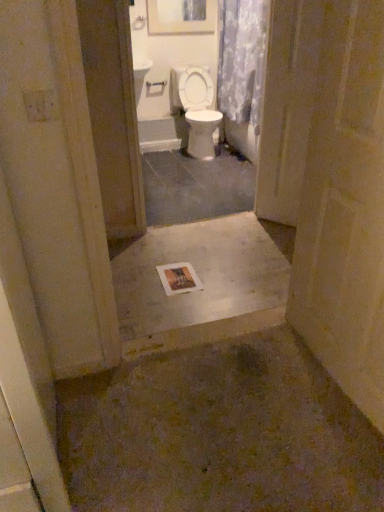
Question: Is smooth concrete slab at center positioned beyond the bounds of wooden framed artwork at upper center?

Choices:
 (A) no
 (B) yes

Answer: (B)

Question: From a real-world perspective, is smooth concrete slab at center below wooden framed artwork at upper center?

Choices:
 (A) yes
 (B) no

Answer: (A)

Question: Is smooth concrete slab at center thinner than wooden framed artwork at upper center?

Choices:
 (A) yes
 (B) no

Answer: (B)

Question: Is smooth concrete slab at center turned away from wooden framed artwork at upper center?

Choices:
 (A) no
 (B) yes

Answer: (A)

Question: From the image's perspective, is smooth concrete slab at center on wooden framed artwork at upper center?

Choices:
 (A) yes
 (B) no

Answer: (B)

Question: Could you tell me if smooth concrete slab at center is facing wooden framed artwork at upper center?

Choices:
 (A) no
 (B) yes

Answer: (A)

Question: Is smooth concrete slab at center oriented towards clear plastic screen door at center?

Choices:
 (A) no
 (B) yes

Answer: (A)

Question: Is smooth concrete slab at center bigger than clear plastic screen door at center?

Choices:
 (A) no
 (B) yes

Answer: (B)

Question: Is smooth concrete slab at center looking in the opposite direction of clear plastic screen door at center?

Choices:
 (A) yes
 (B) no

Answer: (B)

Question: From a real-world perspective, is smooth concrete slab at center positioned under clear plastic screen door at center based on gravity?

Choices:
 (A) yes
 (B) no

Answer: (A)

Question: Considering the relative positions of smooth concrete slab at center and clear plastic screen door at center in the image provided, is smooth concrete slab at center behind clear plastic screen door at center?

Choices:
 (A) yes
 (B) no

Answer: (B)

Question: Is smooth concrete slab at center not inside clear plastic screen door at center?

Choices:
 (A) yes
 (B) no

Answer: (A)

Question: Is floral fabric shower curtain at upper center completely or partially outside of wooden framed artwork at upper center?

Choices:
 (A) no
 (B) yes

Answer: (B)